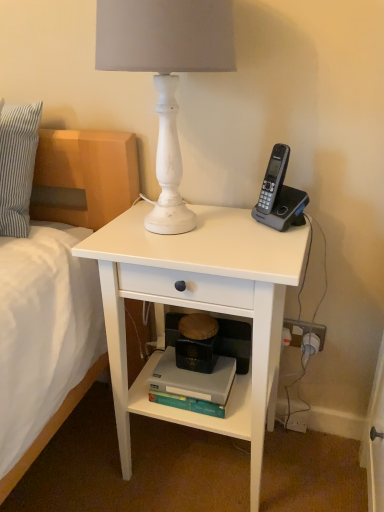
Identify the location of vacant space to the left of white matte desk at center. This screenshot has width=384, height=512. (x=82, y=455).